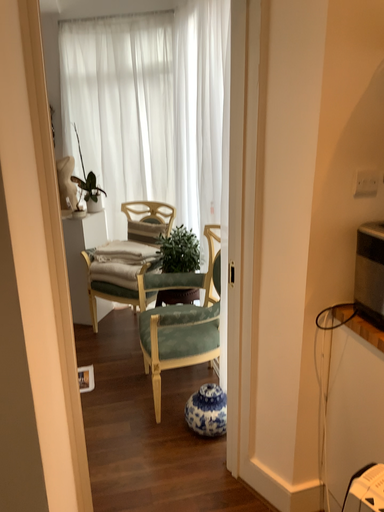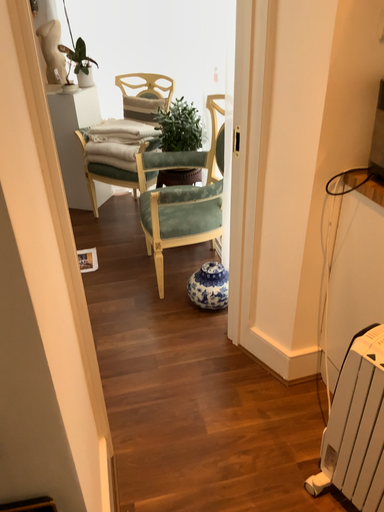
Question: Which way did the camera rotate in the video?

Choices:
 (A) rotated upward
 (B) rotated downward

Answer: (B)